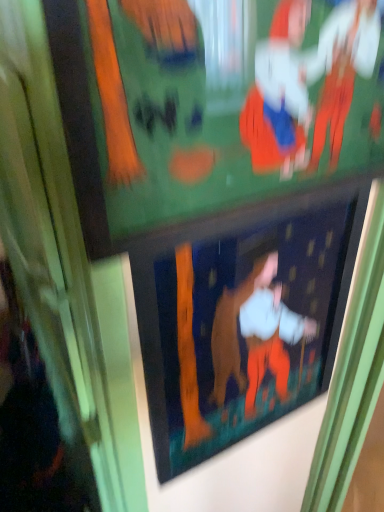
Question: Looking at the image, does matte green bulletin board at upper center seem bigger or smaller compared to matte black picture frame at center?

Choices:
 (A) big
 (B) small

Answer: (A)

Question: From a real-world perspective, is matte green bulletin board at upper center positioned above or below matte black picture frame at center?

Choices:
 (A) above
 (B) below

Answer: (A)

Question: Is point click(344, 150) positioned closer to the camera than point click(195, 307)?

Choices:
 (A) closer
 (B) farther

Answer: (A)

Question: Considering their positions, is matte black picture frame at center located in front of or behind matte green bulletin board at upper center?

Choices:
 (A) front
 (B) behind

Answer: (B)

Question: Considering the positions of matte black picture frame at center and matte green bulletin board at upper center in the image, is matte black picture frame at center wider or thinner than matte green bulletin board at upper center?

Choices:
 (A) thin
 (B) wide

Answer: (A)

Question: Is point (193, 278) positioned closer to the camera than point (289, 152)?

Choices:
 (A) farther
 (B) closer

Answer: (A)

Question: Is matte black picture frame at center situated inside matte green bulletin board at upper center or outside?

Choices:
 (A) outside
 (B) inside

Answer: (A)